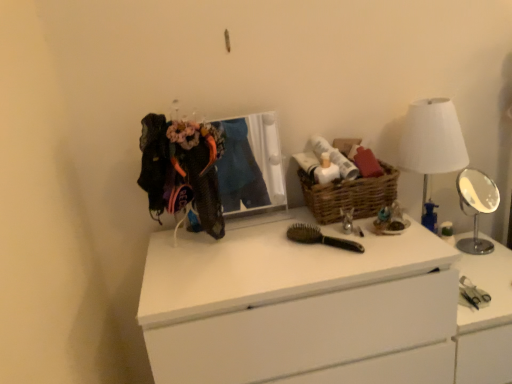
Question: Is white fabric lampshade at right at the back of white plastic vanity at right?

Choices:
 (A) yes
 (B) no

Answer: (B)

Question: Considering the relative sizes of white plastic vanity at right and white fabric lampshade at right in the image provided, is white plastic vanity at right smaller than white fabric lampshade at right?

Choices:
 (A) no
 (B) yes

Answer: (A)

Question: Does white plastic vanity at right have a larger size compared to white fabric lampshade at right?

Choices:
 (A) yes
 (B) no

Answer: (A)

Question: Does white plastic vanity at right appear on the right side of white fabric lampshade at right?

Choices:
 (A) no
 (B) yes

Answer: (B)

Question: From the image's perspective, is white plastic vanity at right beneath white fabric lampshade at right?

Choices:
 (A) no
 (B) yes

Answer: (B)

Question: Considering their positions, is woven brown basket at center located in front of or behind knitted fabric clothesline at upper left?

Choices:
 (A) front
 (B) behind

Answer: (B)

Question: Is woven brown basket at center taller or shorter than knitted fabric clothesline at upper left?

Choices:
 (A) short
 (B) tall

Answer: (A)

Question: Considering the positions of point (329, 211) and point (207, 142), is point (329, 211) closer or farther from the camera than point (207, 142)?

Choices:
 (A) farther
 (B) closer

Answer: (A)

Question: Would you say woven brown basket at center is to the left or to the right of knitted fabric clothesline at upper left in the picture?

Choices:
 (A) left
 (B) right

Answer: (B)

Question: Looking at their shapes, would you say silver metallic mirror at right is wider or thinner than white matte chest of drawers at center?

Choices:
 (A) wide
 (B) thin

Answer: (B)

Question: In the image, is silver metallic mirror at right positioned in front of or behind white matte chest of drawers at center?

Choices:
 (A) front
 (B) behind

Answer: (B)

Question: From a real-world perspective, is silver metallic mirror at right physically located above or below white matte chest of drawers at center?

Choices:
 (A) below
 (B) above

Answer: (B)

Question: From their relative heights in the image, would you say silver metallic mirror at right is taller or shorter than white matte chest of drawers at center?

Choices:
 (A) tall
 (B) short

Answer: (B)

Question: In terms of width, does white fabric lampshade at right look wider or thinner when compared to woven brown basket at center?

Choices:
 (A) thin
 (B) wide

Answer: (B)

Question: From their relative heights in the image, would you say white fabric lampshade at right is taller or shorter than woven brown basket at center?

Choices:
 (A) short
 (B) tall

Answer: (B)